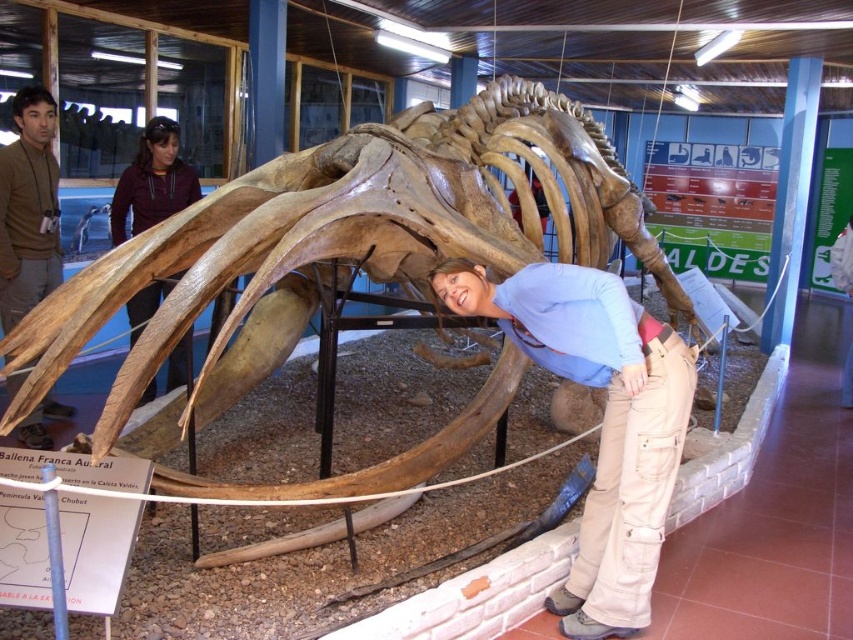
Is beige cotton pants at lower center closer to camera compared to brown leather jacket at upper left?

Yes, it is in front of brown leather jacket at upper left.

Does point (618, 589) come closer to viewer compared to point (35, 138)?

Yes, it is in front of point (35, 138).

In order to click on beige cotton pants at lower center in this screenshot , I will do `click(602, 420)`.

Who is positioned more to the left, beige cotton pants at lower center or dark brown leather jacket at upper left?

Positioned to the left is dark brown leather jacket at upper left.

Does beige cotton pants at lower center appear over dark brown leather jacket at upper left?

No, beige cotton pants at lower center is not above dark brown leather jacket at upper left.

Is point (630, 428) farther from viewer compared to point (142, 221)?

No, (630, 428) is closer to viewer.

The height and width of the screenshot is (640, 853). Find the location of `beige cotton pants at lower center`. beige cotton pants at lower center is located at coordinates (602, 420).

Is brown leather jacket at upper left shorter than dark brown leather jacket at upper left?

No, brown leather jacket at upper left is not shorter than dark brown leather jacket at upper left.

Is point (3, 237) behind point (173, 193)?

No.

Is point (49, 216) farther from camera compared to point (173, 129)?

No, it is in front of (173, 129).

Where is `brown leather jacket at upper left`? Image resolution: width=853 pixels, height=640 pixels. brown leather jacket at upper left is located at coordinates (28, 209).